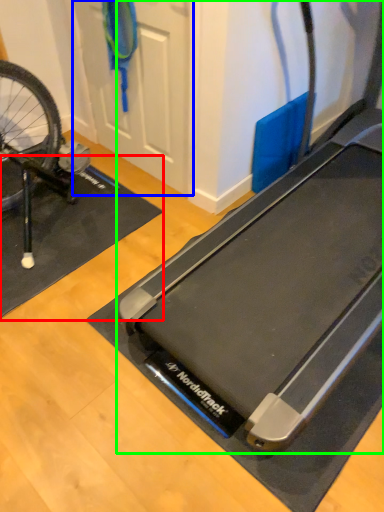
Question: Considering the real-world distances, which object is farthest from yoga mat (highlighted by a red box)? door (highlighted by a blue box) or treadmill (highlighted by a green box)?

Choices:
 (A) door
 (B) treadmill

Answer: (B)